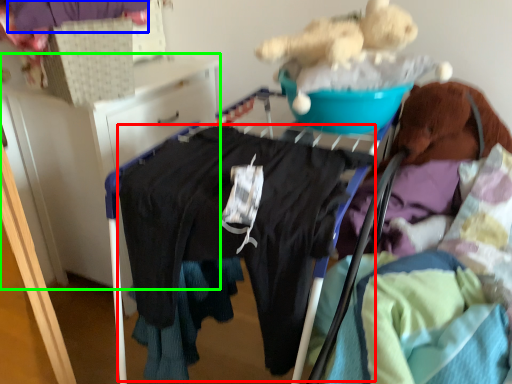
Question: Estimate the real-world distances between objects in this image. Which object is closer to clothing (highlighted by a red box), clothing (highlighted by a blue box) or furniture (highlighted by a green box)?

Choices:
 (A) clothing
 (B) furniture

Answer: (B)